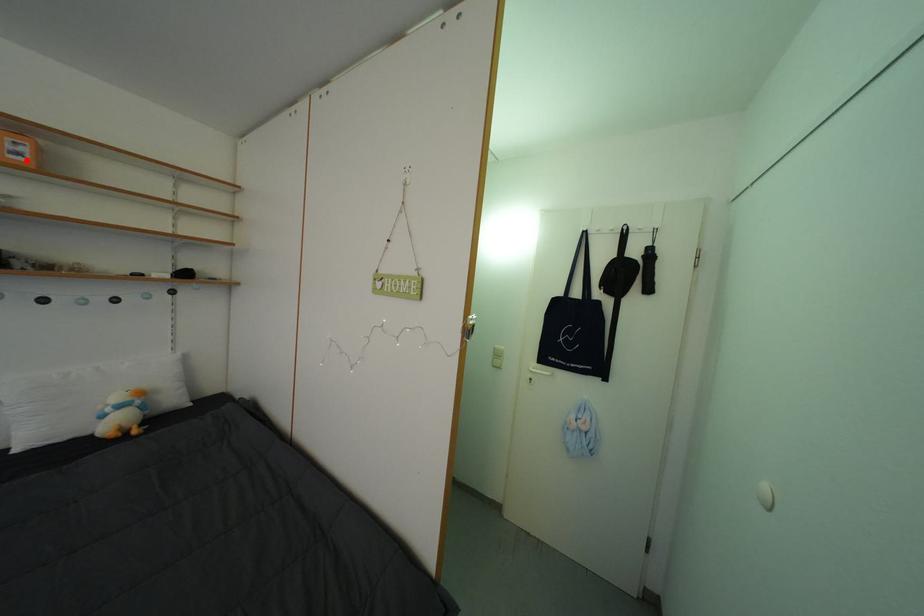
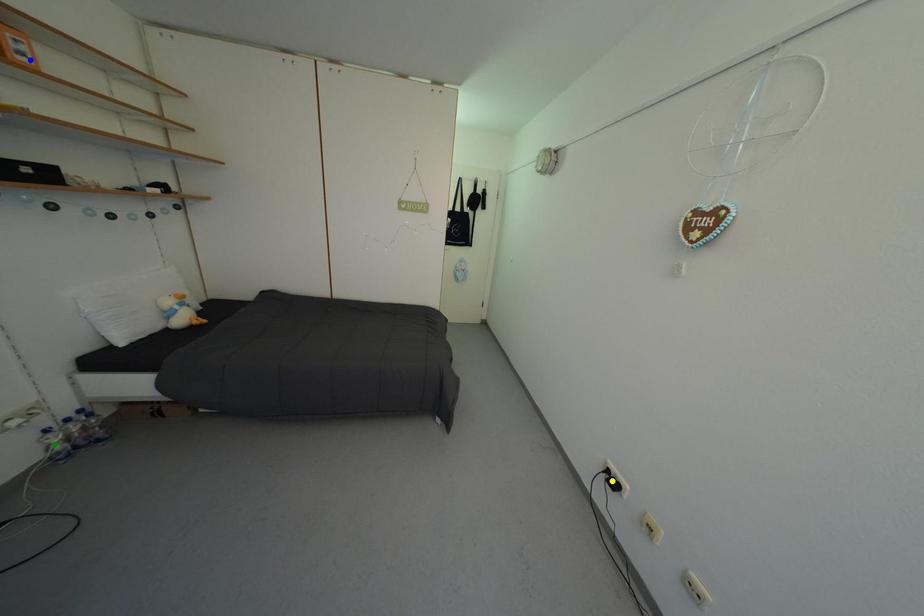
Question: I am providing you with two images of the same scene from different viewpoints. A red point is marked on the first image. You are given multiple points on the second image. In image 2, which mark is for the same physical point as the one in image 1?

Choices:
 (A) yellow point
 (B) blue point
 (C) green point

Answer: (B)